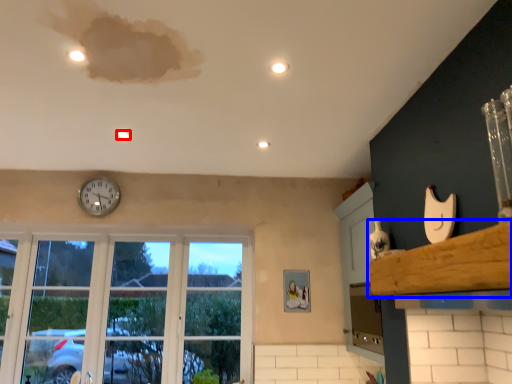
Question: Which object is closer to the camera taking this photo, light (highlighted by a red box) or window sill (highlighted by a blue box)?

Choices:
 (A) light
 (B) window sill

Answer: (B)